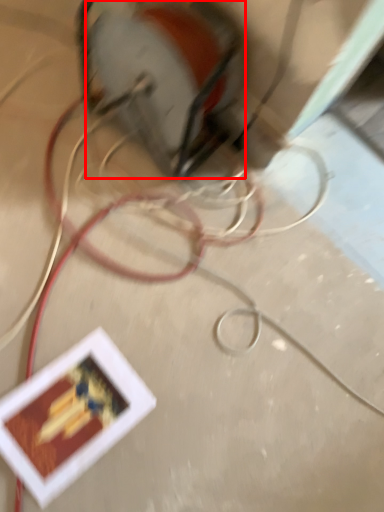
Question: From the image, what is the correct spatial relationship of power plugs and sockets (annotated by the red box) in relation to wire?

Choices:
 (A) right
 (B) left

Answer: (B)